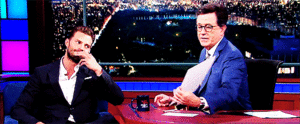
Image resolution: width=300 pixels, height=124 pixels. I want to click on blue bar area to the far right, so click(x=282, y=88).